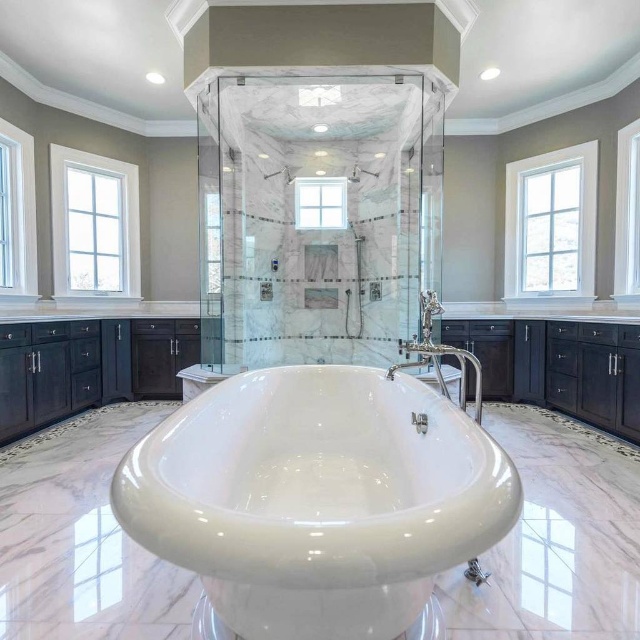
Question: Which of the following is the farthest from the observer?

Choices:
 (A) (620, 234)
 (B) (122, 211)
 (C) (301, 189)

Answer: (B)

Question: Which of the following is the farthest from the observer?

Choices:
 (A) white glossy bathtub at center
 (B) white wood window at upper right
 (C) polished chrome faucet at center
 (D) translucent glass shower at center

Answer: (B)

Question: From the image, what is the correct spatial relationship of white glass window at left in relation to white glass window at upper left?

Choices:
 (A) left
 (B) right

Answer: (B)

Question: Does white glass window at upper left have a smaller size compared to polished chrome faucet at center?

Choices:
 (A) no
 (B) yes

Answer: (B)

Question: Does white glass window at left appear under clear glass window at center?

Choices:
 (A) no
 (B) yes

Answer: (A)

Question: Which is nearer to the white glass window at upper left?

Choices:
 (A) white glass window at upper right
 (B) white glass window at left
 (C) clear glass window at upper center

Answer: (B)